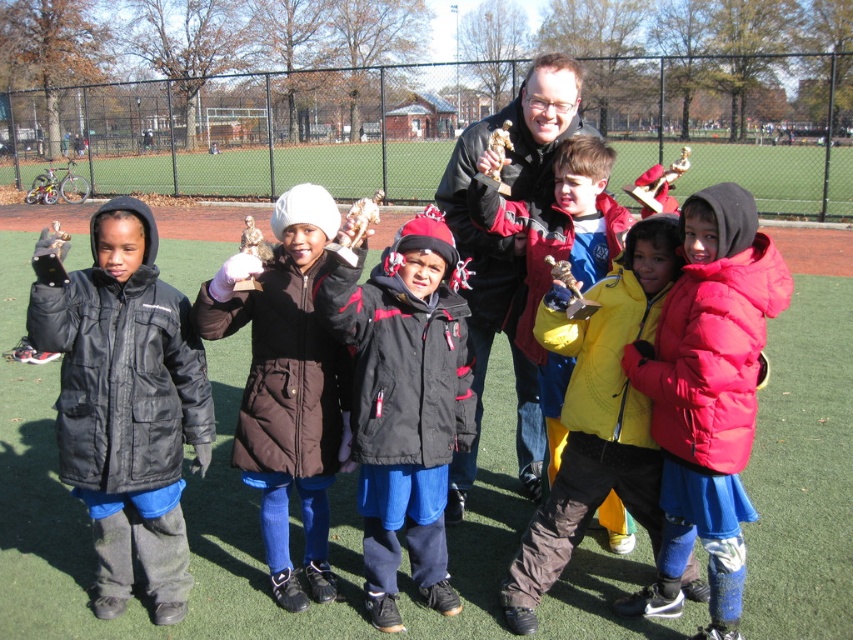
Question: In this image, where is brown matte jacket at center located relative to matte black jacket at center?

Choices:
 (A) below
 (B) above

Answer: (A)

Question: Which object is positioned farthest from the red puffy jacket at center?

Choices:
 (A) yellow matte jacket at center
 (B) matte black jacket at center

Answer: (B)

Question: Among these points, which one is nearest to the camera?

Choices:
 (A) (544, 188)
 (B) (544, 280)
 (C) (59, 467)
 (D) (416, 525)

Answer: (C)

Question: Does black matte jacket at center have a larger size compared to yellow matte jacket at center?

Choices:
 (A) yes
 (B) no

Answer: (B)

Question: Which of the following is the closest to the observer?

Choices:
 (A) yellow matte jacket at center
 (B) black puffy jacket at left
 (C) red puffy jacket at center

Answer: (C)

Question: Does brown matte jacket at center have a smaller size compared to matte black jacket at center?

Choices:
 (A) yes
 (B) no

Answer: (B)